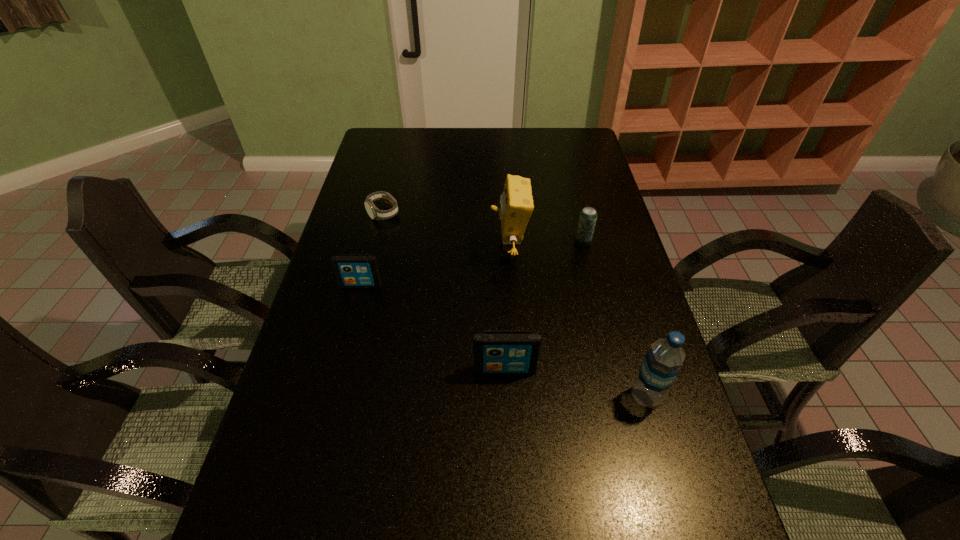
Where is `empty space that is in between the shortest object and the right iPod`? empty space that is in between the shortest object and the right iPod is located at coordinates (444, 292).

Find the location of a particular element. blank region between the nearer iPod and the watch is located at coordinates (444, 292).

The image size is (960, 540). In order to click on free space that is in between the farther iPod and the shortest object in this screenshot , I will do `click(372, 249)`.

You are a GUI agent. You are given a task and a screenshot of the screen. Output one action in this format:
    pyautogui.click(x=<x>, y=<y>)
    Task: Click on the free space between the beer can and the farther iPod
    The image size is (960, 540).
    Given the screenshot: What is the action you would take?
    pyautogui.click(x=472, y=264)

Image resolution: width=960 pixels, height=540 pixels. I want to click on free space between the fifth farthest object and the shortest object, so click(444, 292).

This screenshot has height=540, width=960. What are the coordinates of `object that is the fifth nearest to the beer can` in the screenshot? It's located at (352, 270).

Identify which object is located as the second nearest to the farther iPod. Please provide its 2D coordinates. Your answer should be formatted as a tuple, i.e. [(x, y)], where the tuple contains the x and y coordinates of a point satisfying the conditions above.

[(516, 201)]

Find the location of a particular element. vacant space that satisfies the following two spatial constraints: 1. on the face of the beer can; 2. on the left side of the shortest object is located at coordinates (376, 243).

I want to click on free region that satisfies the following two spatial constraints: 1. on the face of the sponge; 2. on the front screen of the nearer iPod, so click(x=516, y=370).

Where is `vacant region that satisfies the following two spatial constraints: 1. on the face of the sponge; 2. on the front screen of the shorter iPod`? Image resolution: width=960 pixels, height=540 pixels. vacant region that satisfies the following two spatial constraints: 1. on the face of the sponge; 2. on the front screen of the shorter iPod is located at coordinates (511, 285).